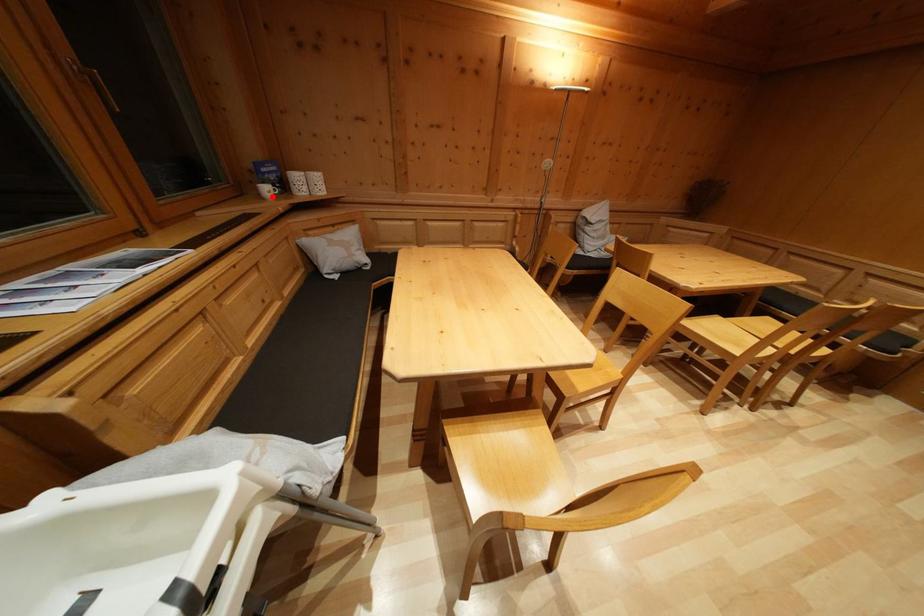
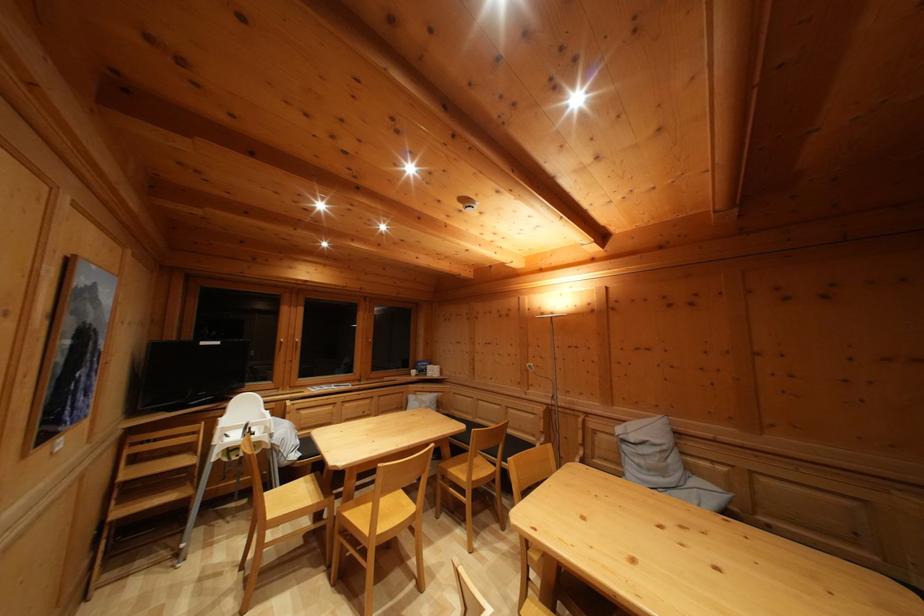
Question: I am providing you with two images of the same scene from different viewpoints. Given a red point in image1, look at the same physical point in image2. Is it:

Choices:
 (A) Closer to the viewpoint
 (B) Farther from the viewpoint

Answer: (B)